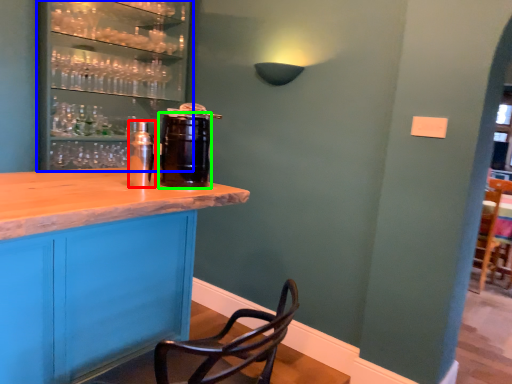
Question: Which is nearer to the beverage (highlighted by a red box)? shelf (highlighted by a blue box) or beverage (highlighted by a green box).

Choices:
 (A) shelf
 (B) beverage

Answer: (B)